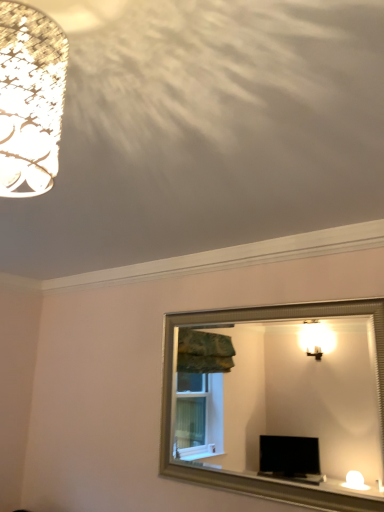
The height and width of the screenshot is (512, 384). What do you see at coordinates (283, 398) in the screenshot?
I see `silver/metallic mirror at center` at bounding box center [283, 398].

This screenshot has height=512, width=384. Find the location of `silver/metallic mirror at center`. silver/metallic mirror at center is located at coordinates (283, 398).

The image size is (384, 512). What are the coordinates of `matte white lampshade at upper left` in the screenshot? It's located at (30, 99).

What is the approximate width of matte white lampshade at upper left?

matte white lampshade at upper left is 7.48 inches in width.

This screenshot has width=384, height=512. What do you see at coordinates (30, 99) in the screenshot?
I see `matte white lampshade at upper left` at bounding box center [30, 99].

Measure the distance between matte white lampshade at upper left and camera.

The depth of matte white lampshade at upper left is 22.24 inches.

Find the location of a particular element. Image resolution: width=384 pixels, height=512 pixels. silver/metallic mirror at center is located at coordinates (283, 398).

Is silver/metallic mirror at center at the left side of matte white lampshade at upper left?

Incorrect, silver/metallic mirror at center is not on the left side of matte white lampshade at upper left.

Is silver/metallic mirror at center further to the viewer compared to matte white lampshade at upper left?

Yes, silver/metallic mirror at center is behind matte white lampshade at upper left.

Which is in front, point (288, 417) or point (50, 183)?

The point (50, 183) is more forward.

From the image's perspective, which is below, silver/metallic mirror at center or matte white lampshade at upper left?

From the image's view, silver/metallic mirror at center is below.

From a real-world perspective, is silver/metallic mirror at center physically above matte white lampshade at upper left?

No.

Between silver/metallic mirror at center and matte white lampshade at upper left, which one has smaller width?

silver/metallic mirror at center.

Between silver/metallic mirror at center and matte white lampshade at upper left, which one has more height?

With more height is silver/metallic mirror at center.

Which of these two, silver/metallic mirror at center or matte white lampshade at upper left, is smaller?

matte white lampshade at upper left.

Is silver/metallic mirror at center completely or partially outside of matte white lampshade at upper left?

silver/metallic mirror at center is positioned outside matte white lampshade at upper left.

Is silver/metallic mirror at center not near matte white lampshade at upper left?

That's right, there is a large distance between silver/metallic mirror at center and matte white lampshade at upper left.

Is silver/metallic mirror at center oriented towards matte white lampshade at upper left?

Yes, silver/metallic mirror at center is turned towards matte white lampshade at upper left.

At what (x,y) coordinates should I click in order to perform the action: click on mirror below the matte white lampshade at upper left (from a real-world perspective). Please return your answer as a coordinate pair (x, y). This screenshot has width=384, height=512. Looking at the image, I should click on (283, 398).

Between matte white lampshade at upper left and silver/metallic mirror at center, which one appears on the left side from the viewer's perspective?

Positioned to the left is matte white lampshade at upper left.

Does matte white lampshade at upper left lie in front of silver/metallic mirror at center?

Yes.

Is point (19, 146) farther from camera compared to point (204, 436)?

No, it is not.

From the image's perspective, who appears lower, matte white lampshade at upper left or silver/metallic mirror at center?

From the image's view, silver/metallic mirror at center is below.

From a real-world perspective, is matte white lampshade at upper left over silver/metallic mirror at center?

Indeed, from a real-world perspective, matte white lampshade at upper left stands above silver/metallic mirror at center.

Can you confirm if matte white lampshade at upper left is wider than silver/metallic mirror at center?

Indeed, matte white lampshade at upper left has a greater width compared to silver/metallic mirror at center.

Between matte white lampshade at upper left and silver/metallic mirror at center, which one has more height?

With more height is silver/metallic mirror at center.

In terms of size, does matte white lampshade at upper left appear bigger or smaller than silver/metallic mirror at center?

In the image, matte white lampshade at upper left appears to be smaller than silver/metallic mirror at center.

Looking at this image, is matte white lampshade at upper left spatially inside silver/metallic mirror at center, or outside of it?

matte white lampshade at upper left is not inside silver/metallic mirror at center, it's outside.

Is matte white lampshade at upper left far away from silver/metallic mirror at center?

That's right, there is a large distance between matte white lampshade at upper left and silver/metallic mirror at center.

Does matte white lampshade at upper left turn towards silver/metallic mirror at center?

No.

Measure the distance from matte white lampshade at upper left to silver/metallic mirror at center.

matte white lampshade at upper left and silver/metallic mirror at center are 17.29 feet apart from each other.

The height and width of the screenshot is (512, 384). Identify the location of lamp to the left of silver/metallic mirror at center. (30, 99).

Where is `lamp located above the silver/metallic mirror at center (from a real-world perspective)`? lamp located above the silver/metallic mirror at center (from a real-world perspective) is located at coordinates [x=30, y=99].

Find the location of a particular element. lamp in front of the silver/metallic mirror at center is located at coordinates (30, 99).